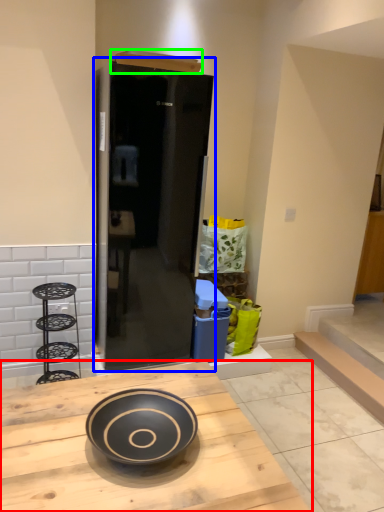
Question: Estimate the real-world distances between objects in this image. Which object is farther from kitchen & dining room table (highlighted by a red box), door (highlighted by a blue box) or box (highlighted by a green box)?

Choices:
 (A) door
 (B) box

Answer: (B)